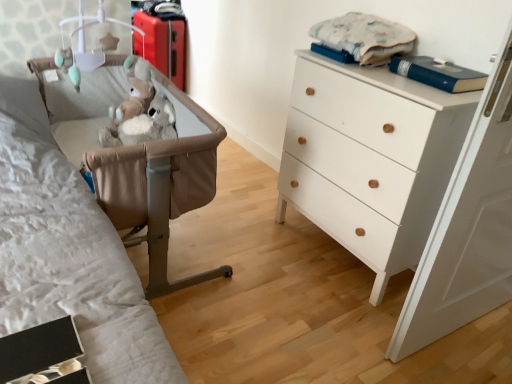
Identify the location of vacant space underneath white wood chest of drawers at right (from a real-world perspective). The width and height of the screenshot is (512, 384). (329, 247).